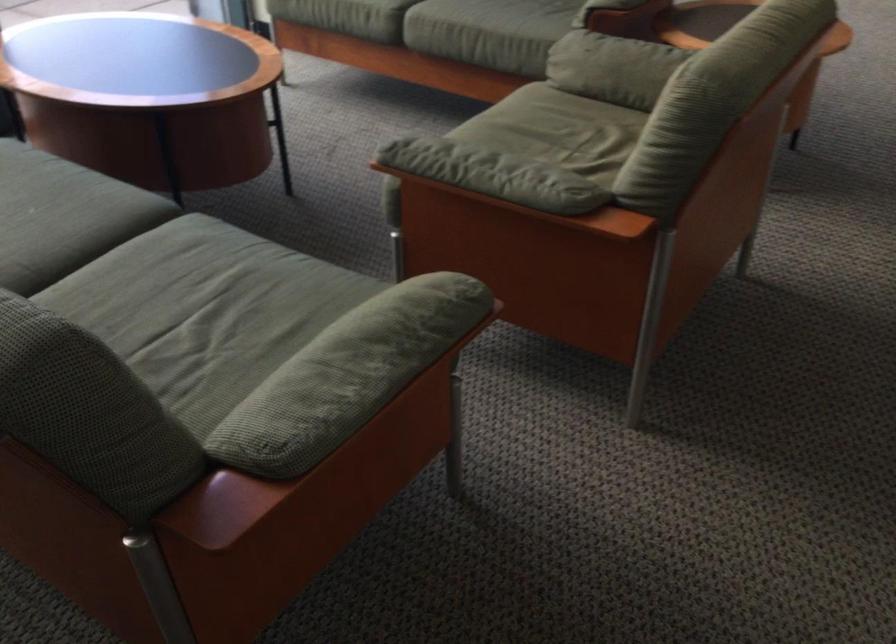
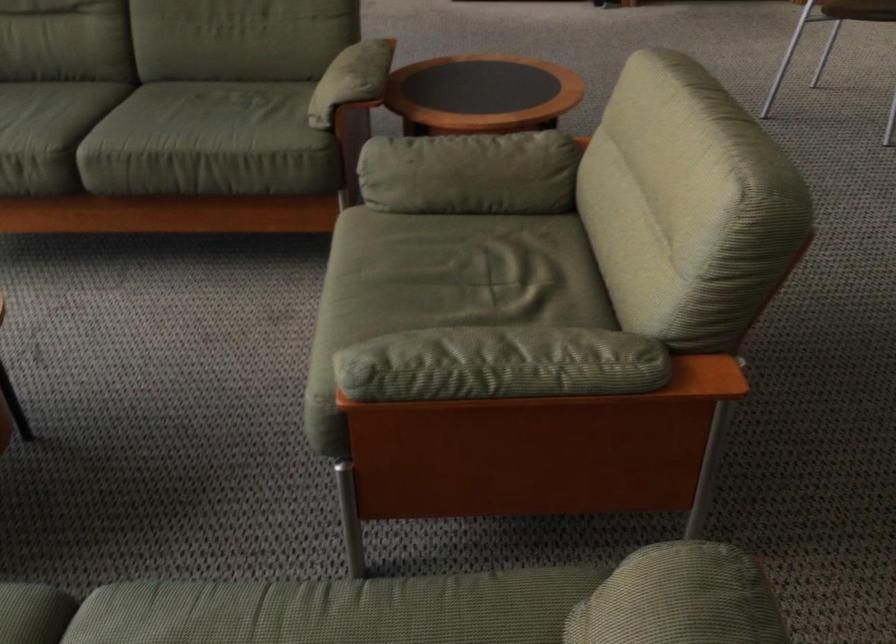
Question: Based on the continuous images, in which direction is the camera rotating? Reply with the corresponding letter.

Choices:
 (A) Left
 (B) Right
 (C) Up
 (D) Down

Answer: (B)